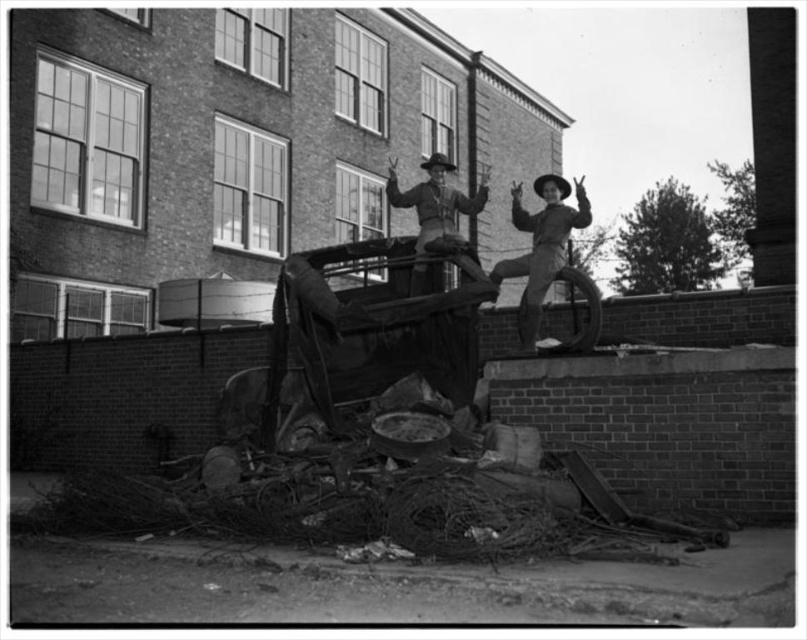
You are a photographer analyzing this scene. You notice the rusty metal debris at lower center and the matte black cowboy hat at upper right. Based on their positions, which object is located to the right side of the other?

The rusty metal debris at lower center is to the left of the matte black cowboy hat at upper right, so the matte black cowboy hat at upper right is to the right of the rusty metal debris at lower center.

You are a photographer setting up a shoot in an urban area with two cowboy hats. You have a matte black cowboy hat at upper right and a matte leather cowboy hat at center. The scene includes a damaged vehicle with scattered debris. If you want to place a 10 feet long banner between the two hats, will there be enough space?

The matte black cowboy hat at upper right is 8.59 feet from the matte leather cowboy hat at center. Since the banner is 10 feet long, which is longer than the distance between the two hats, there won not be enough space to place the banner between them.